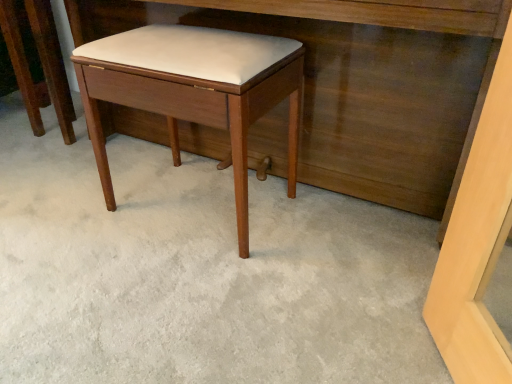
Where is `matte wood stool at center`? Image resolution: width=512 pixels, height=384 pixels. matte wood stool at center is located at coordinates (52, 64).

You are a GUI agent. You are given a task and a screenshot of the screen. Output one action in this format:
    pyautogui.click(x=<x>, y=<y>)
    Task: Click on the matte wood stool at center
    
    Given the screenshot: What is the action you would take?
    pyautogui.click(x=195, y=90)

Based on the photo, does matte wood vanity at center have a larger size compared to matte wood stool at center?

Indeed, matte wood vanity at center has a larger size compared to matte wood stool at center.

From a real-world perspective, is matte wood vanity at center positioned above or below matte wood stool at center?

In terms of real-world spatial position, matte wood vanity at center is above matte wood stool at center.

Considering the positions of objects matte wood vanity at center and matte wood stool at center in the image provided, who is in front, matte wood vanity at center or matte wood stool at center?

matte wood vanity at center is more forward.

Where is `stool on the right side of matte wood stool at center`? This screenshot has height=384, width=512. stool on the right side of matte wood stool at center is located at coordinates (195, 90).

Is matte wood stool at center taller or shorter than matte wood stool at center?

matte wood stool at center is taller than matte wood stool at center.

Considering the relative sizes of matte wood stool at center and matte wood stool at center in the image provided, is matte wood stool at center smaller than matte wood stool at center?

Yes, matte wood stool at center is smaller than matte wood stool at center.

Does matte wood stool at center turn towards matte wood stool at center?

No, matte wood stool at center is not facing towards matte wood stool at center.

Is matte wood stool at center looking in the opposite direction of matte wood vanity at center?

No, matte wood vanity at center is not at the back of matte wood stool at center.

Considering the sizes of matte wood stool at center and matte wood vanity at center in the image, is matte wood stool at center taller or shorter than matte wood vanity at center?

matte wood stool at center is shorter than matte wood vanity at center.

Considering the relative sizes of matte wood stool at center and matte wood vanity at center in the image provided, is matte wood stool at center bigger than matte wood vanity at center?

Incorrect, matte wood stool at center is not larger than matte wood vanity at center.

Does matte wood stool at center have a greater width compared to matte wood vanity at center?

Incorrect, the width of matte wood stool at center does not surpass that of matte wood vanity at center.

From the picture: From a real-world perspective, which is physically above, matte wood stool at center or matte wood stool at center?

matte wood stool at center.

Is matte wood stool at center bigger or smaller than matte wood stool at center?

In the image, matte wood stool at center appears to be larger than matte wood stool at center.

In terms of width, does matte wood stool at center look wider or thinner when compared to matte wood stool at center?

In the image, matte wood stool at center appears to be wider than matte wood stool at center.

From the image's perspective, which one is positioned higher, matte wood stool at center or matte wood stool at center?

From the image's view, matte wood stool at center is above.

Is matte wood stool at center at the back of matte wood vanity at center?

No, matte wood vanity at center is not facing the opposite direction of matte wood stool at center.

Are matte wood vanity at center and matte wood stool at center far apart?

Actually, matte wood vanity at center and matte wood stool at center are a little close together.

Which is less distant, [392,44] or [67,98]?

The point [392,44] is closer.

In the scene shown: Considering the relative sizes of matte wood vanity at center and matte wood stool at center in the image provided, is matte wood vanity at center wider than matte wood stool at center?

Correct, the width of matte wood vanity at center exceeds that of matte wood stool at center.

Is matte wood stool at center oriented away from matte wood vanity at center?

That's right, matte wood stool at center is facing away from matte wood vanity at center.

Visually, is matte wood stool at center positioned to the left or to the right of matte wood vanity at center?

Clearly, matte wood stool at center is on the left of matte wood vanity at center in the image.

Is matte wood stool at center surrounding matte wood vanity at center?

No.

Locate an element on the screen. vanity in front of the matte wood stool at center is located at coordinates (359, 82).

This screenshot has width=512, height=384. Find the location of `furniture that is above the matte wood stool at center (from a real-world perspective)`. furniture that is above the matte wood stool at center (from a real-world perspective) is located at coordinates (52, 64).

Which object lies further to the anchor point matte wood vanity at center, matte wood stool at center or matte wood stool at center?

matte wood stool at center.

Looking at the image, which one is located closer to matte wood vanity at center, matte wood stool at center or matte wood stool at center?

matte wood stool at center is positioned closer to the anchor matte wood vanity at center.

Which object lies further to the anchor point matte wood stool at center, matte wood vanity at center or matte wood stool at center?

Among the two, matte wood stool at center is located further to matte wood stool at center.

Considering their positions, is matte wood stool at center positioned further to matte wood stool at center than matte wood vanity at center?

matte wood stool at center.

Which object lies further to the anchor point matte wood stool at center, matte wood vanity at center or matte wood stool at center?

matte wood stool at center is positioned further to the anchor matte wood stool at center.

Considering their positions, is matte wood stool at center positioned closer to matte wood stool at center than matte wood vanity at center?

Among the two, matte wood vanity at center is located nearer to matte wood stool at center.

This screenshot has height=384, width=512. Find the location of `stool between matte wood stool at center and matte wood vanity at center from left to right`. stool between matte wood stool at center and matte wood vanity at center from left to right is located at coordinates (195, 90).